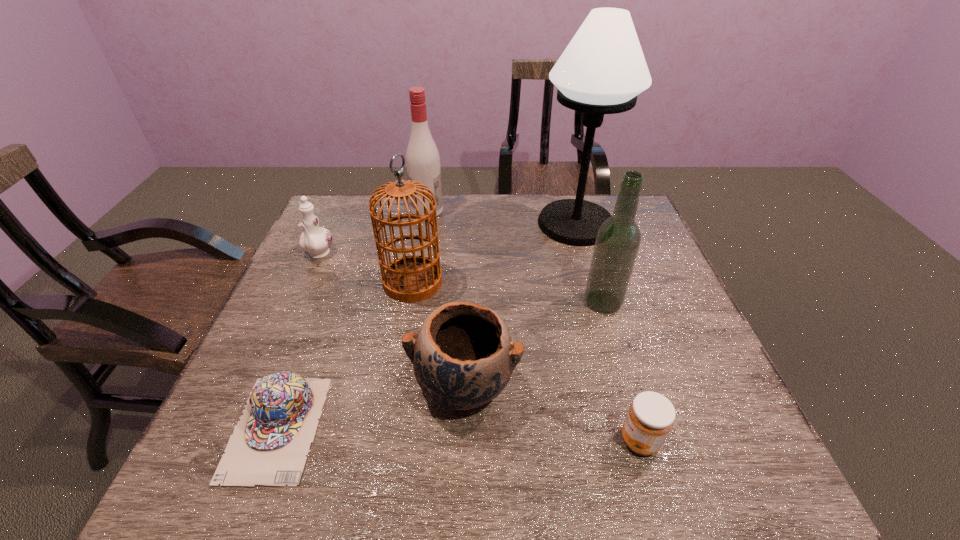
Identify the location of vacant space at the right edge of the desktop. (682, 325).

At what (x,y) coordinates should I click in order to perform the action: click on vacant space at the far left corner of the desktop. Please return your answer as a coordinate pair (x, y). This screenshot has height=540, width=960. Looking at the image, I should click on pyautogui.click(x=343, y=210).

Find the location of a particular element. free space between the shortest object and the alcohol is located at coordinates (352, 319).

Locate an element on the screen. unoccupied area between the alcohol and the table lamp is located at coordinates [501, 218].

Identify the location of free point between the pottery and the shortest object. (371, 407).

This screenshot has height=540, width=960. Find the location of `free space between the second shortest object and the pottery`. free space between the second shortest object and the pottery is located at coordinates (552, 414).

Identify the location of free space that is in between the table lamp and the liquor. Image resolution: width=960 pixels, height=540 pixels. (589, 263).

This screenshot has width=960, height=540. What are the coordinates of `free space that is in between the alcohol and the cap` in the screenshot? It's located at (352, 319).

Where is `empty space between the cap and the birdcage`? empty space between the cap and the birdcage is located at coordinates (345, 355).

At what (x,y) coordinates should I click in order to perform the action: click on free space between the shortest object and the birdcage. Please return your answer as a coordinate pair (x, y). Image resolution: width=960 pixels, height=540 pixels. Looking at the image, I should click on (345, 355).